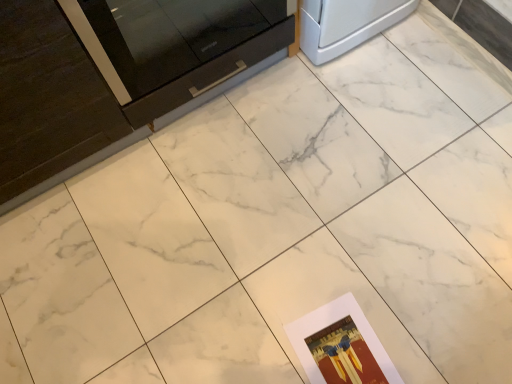
Find the location of a particular element. free point above matte paper postcard at lower right (from a real-world perspective) is located at coordinates (346, 347).